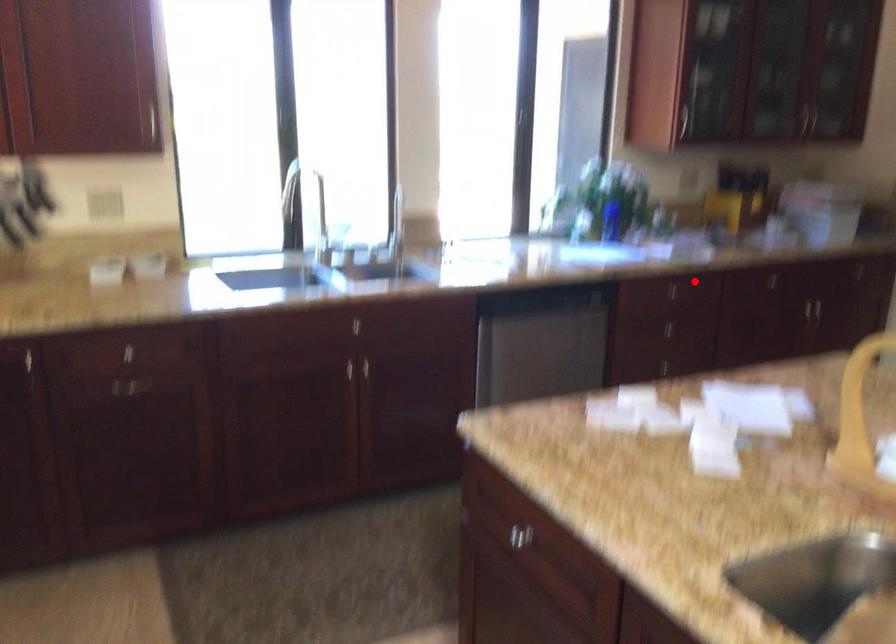
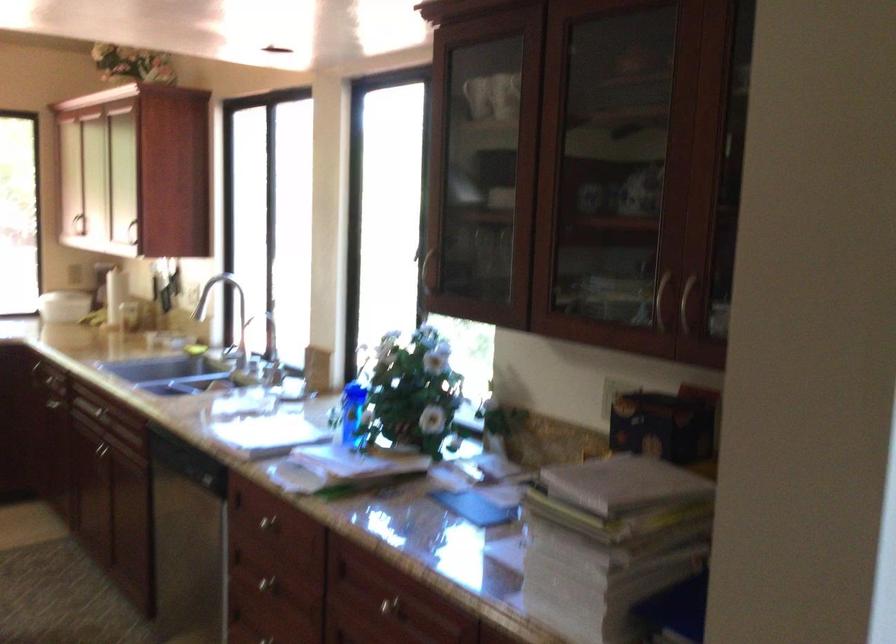
Question: I am providing you with two images of the same scene from different viewpoints. Image1 has a red point marked. In image2, the corresponding 3D location appears at what relative position? Reply with the corresponding letter.

Choices:
 (A) Closer
 (B) Farther

Answer: (A)